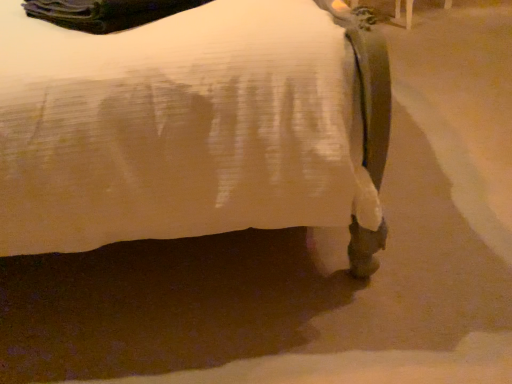
Question: Do you think metallic silver bedpost at upper right is within white matte bed at lower right, or outside of it?

Choices:
 (A) outside
 (B) inside

Answer: (A)

Question: Looking at the image, does metallic silver bedpost at upper right seem bigger or smaller compared to white matte bed at lower right?

Choices:
 (A) small
 (B) big

Answer: (A)

Question: In terms of height, does metallic silver bedpost at upper right look taller or shorter compared to white matte bed at lower right?

Choices:
 (A) tall
 (B) short

Answer: (B)

Question: Is white matte bed at lower right inside or outside of metallic silver bedpost at upper right?

Choices:
 (A) outside
 (B) inside

Answer: (A)

Question: From the image's perspective, relative to metallic silver bedpost at upper right, is white matte bed at lower right above or below?

Choices:
 (A) above
 (B) below

Answer: (B)

Question: Is white matte bed at lower right in front of or behind metallic silver bedpost at upper right in the image?

Choices:
 (A) front
 (B) behind

Answer: (A)

Question: Is point (130, 33) closer or farther from the camera than point (394, 1)?

Choices:
 (A) farther
 (B) closer

Answer: (B)